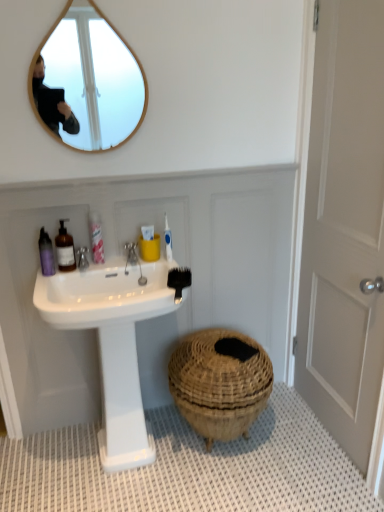
Identify the location of free space above white textured bath mat at lower center (from a real-world perspective). The width and height of the screenshot is (384, 512). (156, 472).